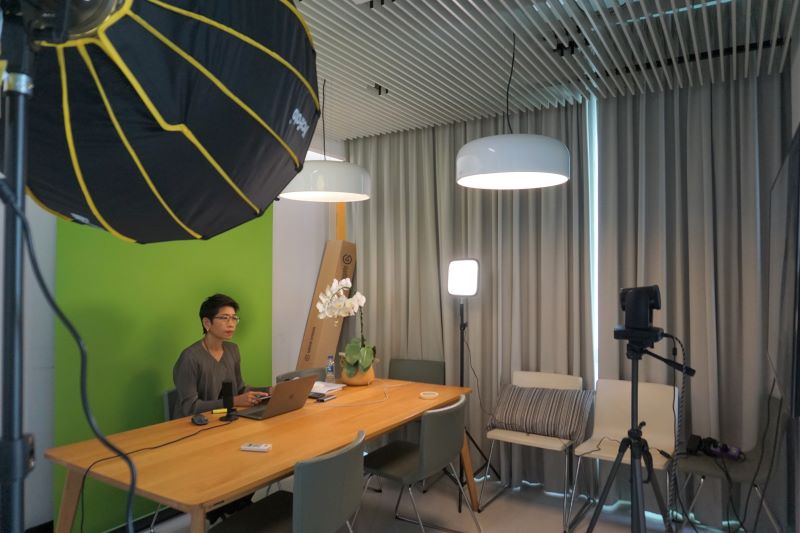
Where is `cardboard box`? Image resolution: width=800 pixels, height=533 pixels. cardboard box is located at coordinates (306, 343).